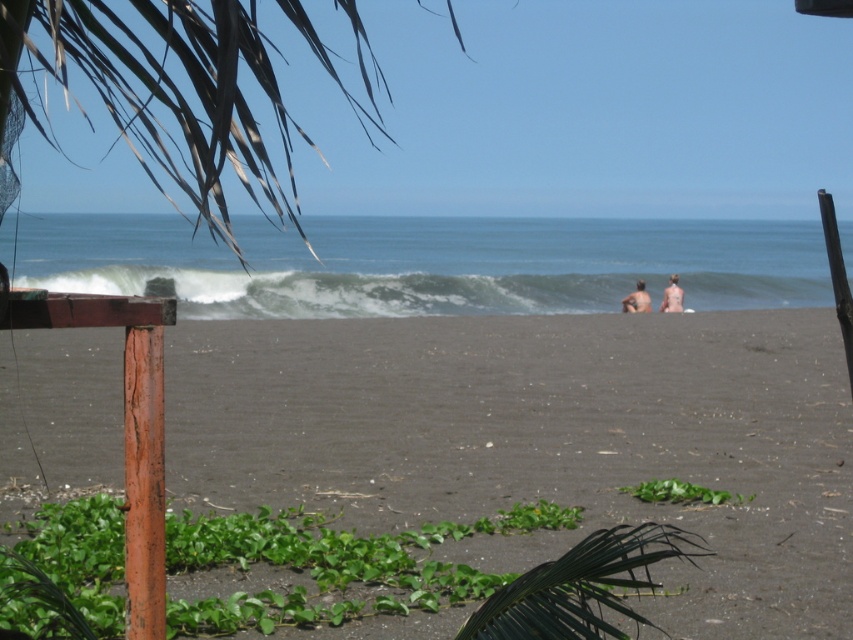
You are standing on the beach and see two points marked on the sand. The first is at point coordinates point (593, 444) and the second is at point (635, 291). Which point is closer to you?

Point (593, 444) is closer to the viewer than point (635, 291).

You are planning to build a small sandcastle on the beach. Given the dark brown sand at center and the blonde hair human at right, which area would be more suitable for building the sandcastle, and why?

The dark brown sand at center is more suitable for building the sandcastle because its width surpasses that of the blonde hair human at right, providing a larger and more stable area for construction.

You are standing at the beach and want to reach the point marked as point (792, 275). If you walk straight ahead, will you reach that point before walking 30 meters?

The point (792, 275) is 32.80 meters from the viewer, so walking straight ahead for 30 meters will not reach it. You need to walk an additional 2.80 meters.